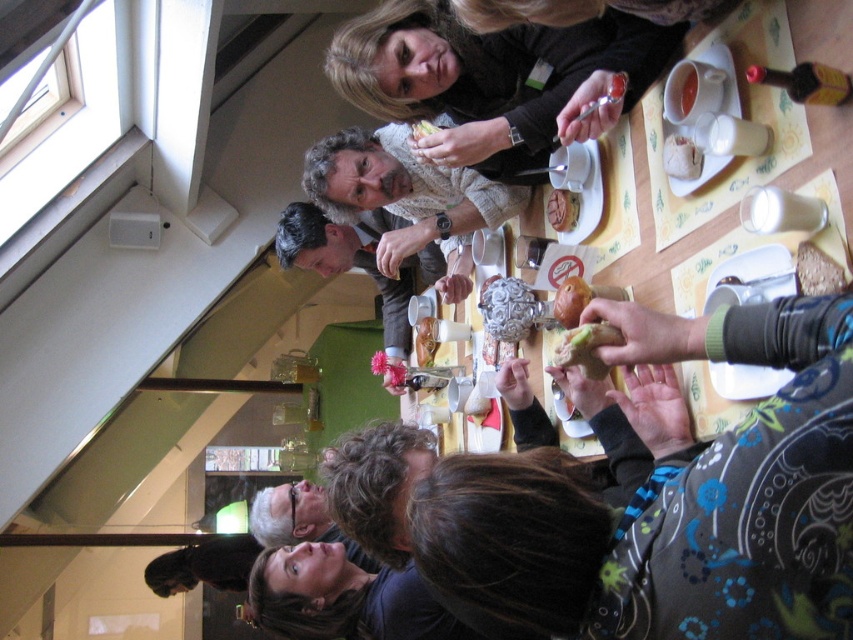
Question: Does brown bread at center appear over smooth yellow cheese at center?

Choices:
 (A) yes
 (B) no

Answer: (B)

Question: Does white crumbly bread at upper right have a greater width compared to smooth yellow cheese at center?

Choices:
 (A) no
 (B) yes

Answer: (A)

Question: Which of these objects is positioned closest to the brown bread at center?

Choices:
 (A) wooden table at center
 (B) smooth yellow cheese at center
 (C) crusty bread at center

Answer: (C)

Question: Can you confirm if matte black sweater at upper center is wider than matte brown jacket at center?

Choices:
 (A) yes
 (B) no

Answer: (A)

Question: Which of the following is the closest to the observer?

Choices:
 (A) matte black sweater at upper center
 (B) slightly toasted bread at center
 (C) crusty bread at center

Answer: (C)

Question: Which object appears farthest from the camera in this image?

Choices:
 (A) smooth yellow cheese at center
 (B) slightly toasted bread at center

Answer: (B)